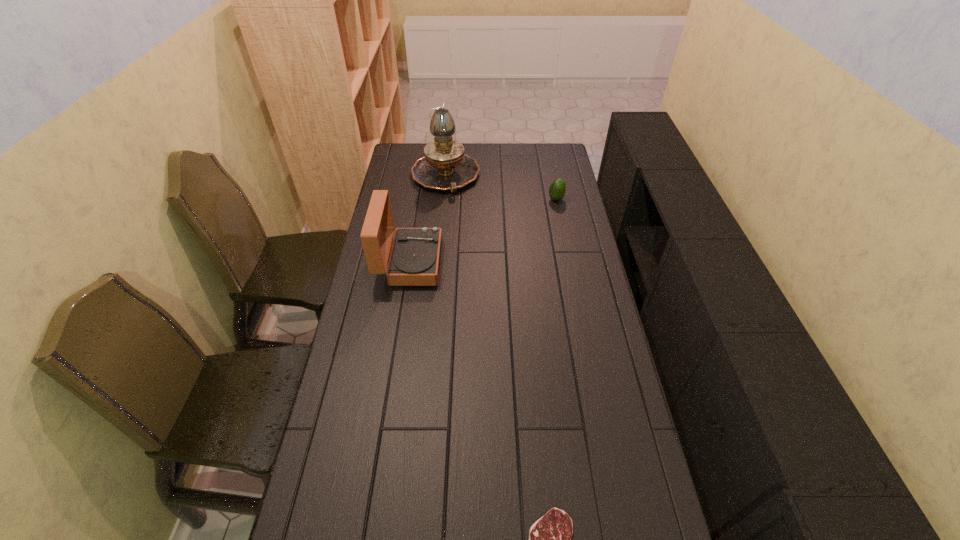
Where is `phonograph record that is at the left edge`? Image resolution: width=960 pixels, height=540 pixels. phonograph record that is at the left edge is located at coordinates (415, 255).

This screenshot has height=540, width=960. Identify the location of object located at the right edge. (557, 190).

Identify the location of object at the far left corner. Image resolution: width=960 pixels, height=540 pixels. (444, 166).

The width and height of the screenshot is (960, 540). In the image, there is a desktop. Find the location of `vacant space at the far edge`. vacant space at the far edge is located at coordinates (476, 154).

This screenshot has width=960, height=540. In the image, there is a desktop. In order to click on vacant space at the left edge in this screenshot , I will do `click(409, 220)`.

Find the location of a particular element. This screenshot has height=540, width=960. blank area at the right edge is located at coordinates (551, 240).

Image resolution: width=960 pixels, height=540 pixels. I want to click on unoccupied position between the third farthest object and the oil lamp, so click(x=427, y=219).

This screenshot has width=960, height=540. I want to click on free spot between the oil lamp and the phonograph record, so click(427, 219).

This screenshot has width=960, height=540. Identify the location of free space between the third tallest object and the third shortest object. (483, 231).

You are a GUI agent. You are given a task and a screenshot of the screen. Output one action in this format:
    pyautogui.click(x=<x>, y=<y>)
    Task: Click on the free space between the oil lamp and the avocado
    
    Given the screenshot: What is the action you would take?
    pyautogui.click(x=501, y=188)